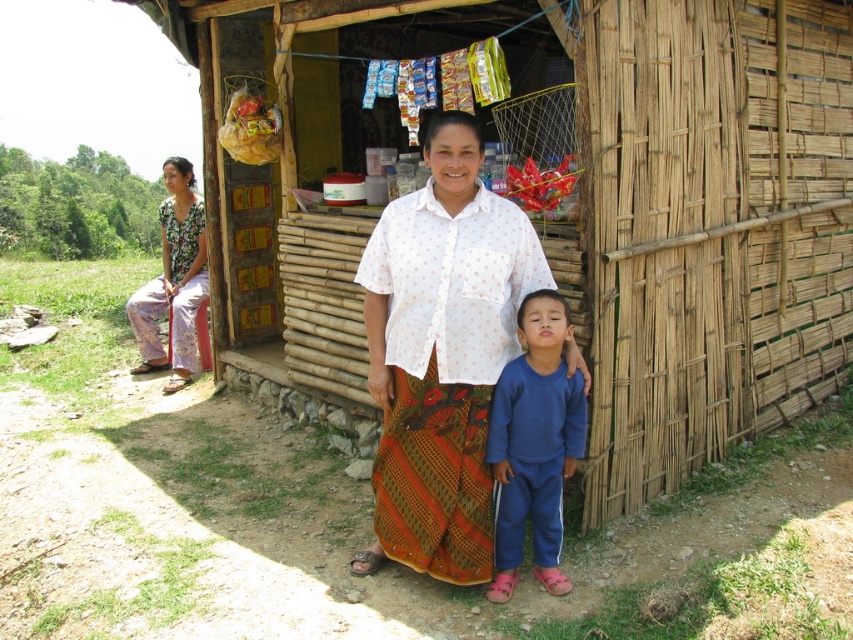
Question: Can you confirm if bamboo hut at center is positioned to the left of floral fabric pants at left?

Choices:
 (A) no
 (B) yes

Answer: (A)

Question: Based on their relative distances, which object is nearer to the white dotted shirt at center?

Choices:
 (A) blue fleece pants at lower right
 (B) bamboo hut at center
 (C) floral fabric pants at left

Answer: (A)

Question: Which object is positioned closest to the white dotted shirt at center?

Choices:
 (A) floral fabric pants at left
 (B) bamboo hut at center
 (C) blue fleece pants at lower right

Answer: (C)

Question: Is bamboo hut at center below white dotted shirt at center?

Choices:
 (A) no
 (B) yes

Answer: (A)

Question: Where is bamboo hut at center located in relation to blue fleece pants at lower right in the image?

Choices:
 (A) above
 (B) below

Answer: (A)

Question: Which point is farther to the camera?

Choices:
 (A) (676, 147)
 (B) (184, 368)
 (C) (566, 392)
 (D) (440, 150)

Answer: (B)